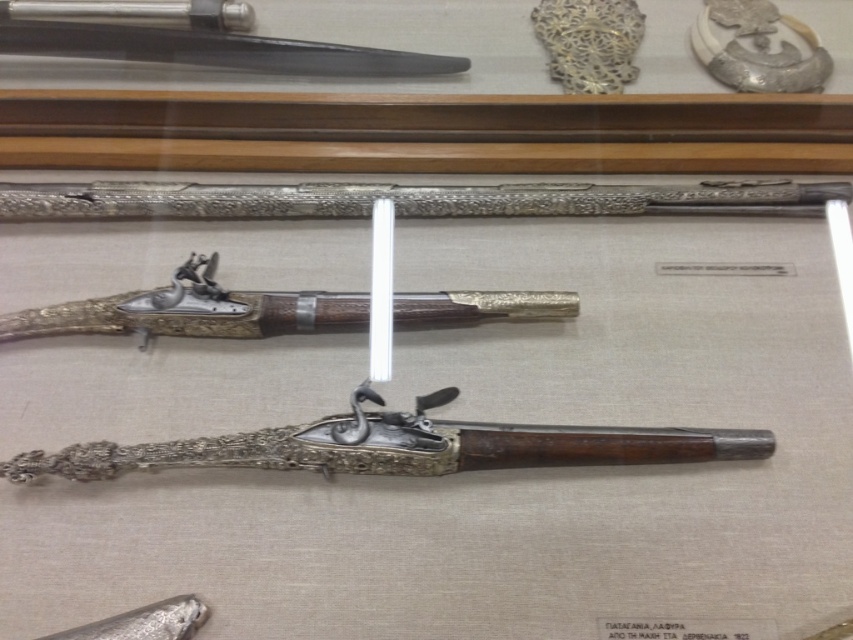
Between polished silver rifle at center and polished silver rifle at upper center, which one appears on the left side from the viewer's perspective?

From the viewer's perspective, polished silver rifle at upper center appears more on the left side.

Between polished silver rifle at center and polished silver rifle at upper center, which one appears on the right side from the viewer's perspective?

Positioned to the right is polished silver rifle at center.

Where is `polished silver rifle at center`? polished silver rifle at center is located at coordinates (398, 445).